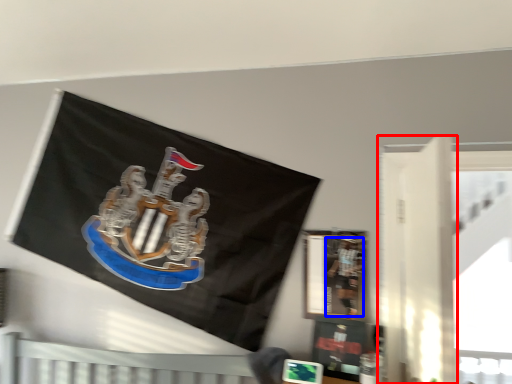
Question: Which object is closer to the camera taking this photo, door (highlighted by a red box) or person (highlighted by a blue box)?

Choices:
 (A) door
 (B) person

Answer: (A)